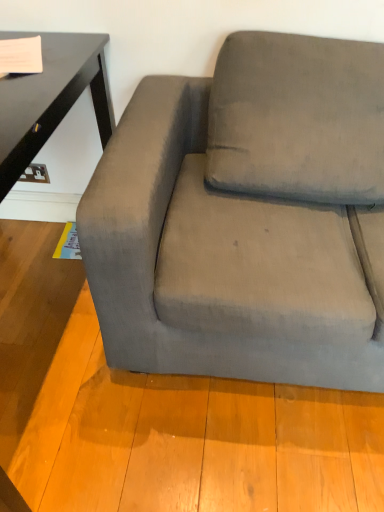
Image resolution: width=384 pixels, height=512 pixels. What do you see at coordinates (246, 218) in the screenshot?
I see `velvet gray couch at center` at bounding box center [246, 218].

You are a GUI agent. You are given a task and a screenshot of the screen. Output one action in this format:
    pyautogui.click(x=<x>, y=<y>)
    Task: Click on the velvet gray couch at center
    
    Given the screenshot: What is the action you would take?
    (246, 218)

The image size is (384, 512). What do you see at coordinates (298, 119) in the screenshot?
I see `suede-like gray pillow at upper right` at bounding box center [298, 119].

This screenshot has width=384, height=512. Identify the location of suede-like gray pillow at upper right. (298, 119).

What are the coordinates of `velvet gray couch at center` in the screenshot? It's located at (246, 218).

Is suede-like gray pillow at upper right to the right of velvet gray couch at center from the viewer's perspective?

Yes.

Who is more distant, suede-like gray pillow at upper right or velvet gray couch at center?

suede-like gray pillow at upper right is behind.

Which is more distant, (x=273, y=47) or (x=252, y=369)?

The point (x=273, y=47) is farther from the camera.

From the image's perspective, which is above, suede-like gray pillow at upper right or velvet gray couch at center?

suede-like gray pillow at upper right is shown above in the image.

From a real-world perspective, relative to velvet gray couch at center, is suede-like gray pillow at upper right vertically above or below?

suede-like gray pillow at upper right is situated higher than velvet gray couch at center in the real world.

Is suede-like gray pillow at upper right thinner than velvet gray couch at center?

Yes, suede-like gray pillow at upper right is thinner than velvet gray couch at center.

Considering the relative sizes of suede-like gray pillow at upper right and velvet gray couch at center in the image provided, is suede-like gray pillow at upper right taller than velvet gray couch at center?

In fact, suede-like gray pillow at upper right may be shorter than velvet gray couch at center.

Can you confirm if suede-like gray pillow at upper right is smaller than velvet gray couch at center?

Correct, suede-like gray pillow at upper right occupies less space than velvet gray couch at center.

Can we say suede-like gray pillow at upper right lies outside velvet gray couch at center?

Actually, suede-like gray pillow at upper right is within velvet gray couch at center.

Are suede-like gray pillow at upper right and velvet gray couch at center located far from each other?

No, suede-like gray pillow at upper right is not far away from velvet gray couch at center.

Is suede-like gray pillow at upper right oriented towards velvet gray couch at center?

Yes, suede-like gray pillow at upper right is oriented towards velvet gray couch at center.

Can you tell me how much suede-like gray pillow at upper right and velvet gray couch at center differ in facing direction?

The angle between the facing direction of suede-like gray pillow at upper right and the facing direction of velvet gray couch at center is 0.268 degrees.

Locate an element on the screen. studio couch located on the left of suede-like gray pillow at upper right is located at coordinates (246, 218).

Considering the relative positions of velvet gray couch at center and suede-like gray pillow at upper right in the image provided, is velvet gray couch at center to the left or to the right of suede-like gray pillow at upper right?

velvet gray couch at center is to the left of suede-like gray pillow at upper right.

Is velvet gray couch at center positioned behind suede-like gray pillow at upper right?

No, velvet gray couch at center is in front of suede-like gray pillow at upper right.

Does point (286, 168) come behind point (280, 131)?

No, it is not.

From the image's perspective, between velvet gray couch at center and suede-like gray pillow at upper right, who is located below?

velvet gray couch at center appears lower in the image.

From a real-world perspective, is velvet gray couch at center positioned above or below suede-like gray pillow at upper right?

velvet gray couch at center is below suede-like gray pillow at upper right.

Which of these two, velvet gray couch at center or suede-like gray pillow at upper right, is thinner?

With smaller width is suede-like gray pillow at upper right.

Is velvet gray couch at center taller or shorter than suede-like gray pillow at upper right?

Considering their sizes, velvet gray couch at center has more height than suede-like gray pillow at upper right.

Considering the relative sizes of velvet gray couch at center and suede-like gray pillow at upper right in the image provided, is velvet gray couch at center smaller than suede-like gray pillow at upper right?

Actually, velvet gray couch at center might be larger than suede-like gray pillow at upper right.

Could suede-like gray pillow at upper right be considered to be inside velvet gray couch at center?

Yes, suede-like gray pillow at upper right is a part of velvet gray couch at center.

Are velvet gray couch at center and suede-like gray pillow at upper right beside each other?

They are not placed beside each other.

Is velvet gray couch at center looking in the opposite direction of suede-like gray pillow at upper right?

Absolutely, velvet gray couch at center is directed away from suede-like gray pillow at upper right.

How different are the orientations of velvet gray couch at center and suede-like gray pillow at upper right in degrees?

They differ by 0.268 degrees in their facing directions.

In order to click on pillow located on the right of velvet gray couch at center in this screenshot , I will do `click(298, 119)`.

Locate an element on the screen. The height and width of the screenshot is (512, 384). pillow behind the velvet gray couch at center is located at coordinates (298, 119).

You are a GUI agent. You are given a task and a screenshot of the screen. Output one action in this format:
    pyautogui.click(x=<x>, y=<y>)
    Task: Click on the pillow that appears above the velvet gray couch at center (from a real-world perspective)
    
    Given the screenshot: What is the action you would take?
    pyautogui.click(x=298, y=119)